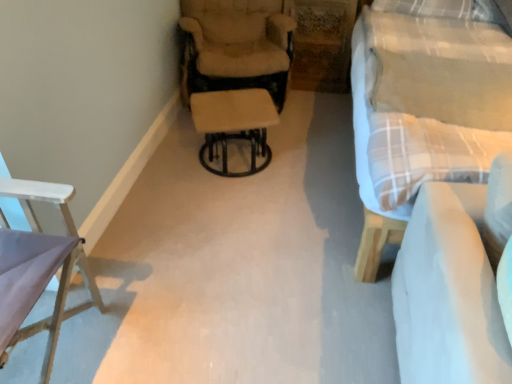
At what (x,y) coordinates should I click in order to perform the action: click on vacant space underneath black metal stool at center (from a real-world perspective). Please return your answer as a coordinate pair (x, y). Looking at the image, I should click on (237, 167).